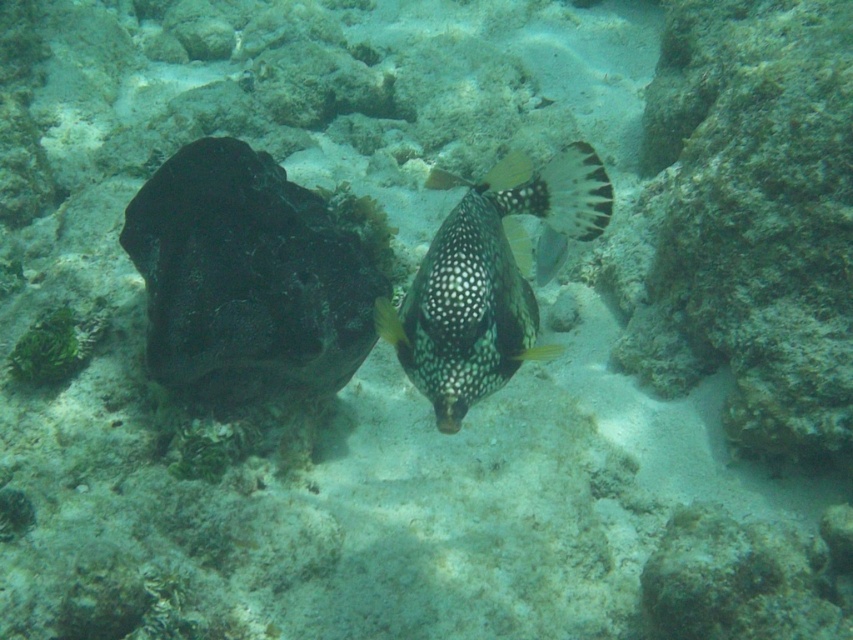
Question: Considering the relative positions of speckled black fish at center and speckled glossy fish at center in the image provided, where is speckled black fish at center located with respect to speckled glossy fish at center?

Choices:
 (A) below
 (B) above

Answer: (B)

Question: Which point is closer to the camera?

Choices:
 (A) speckled glossy fish at center
 (B) speckled black fish at center

Answer: (A)

Question: Where is speckled black fish at center located in relation to speckled glossy fish at center in the image?

Choices:
 (A) above
 (B) below

Answer: (A)

Question: Does speckled black fish at center appear on the left side of speckled glossy fish at center?

Choices:
 (A) yes
 (B) no

Answer: (A)